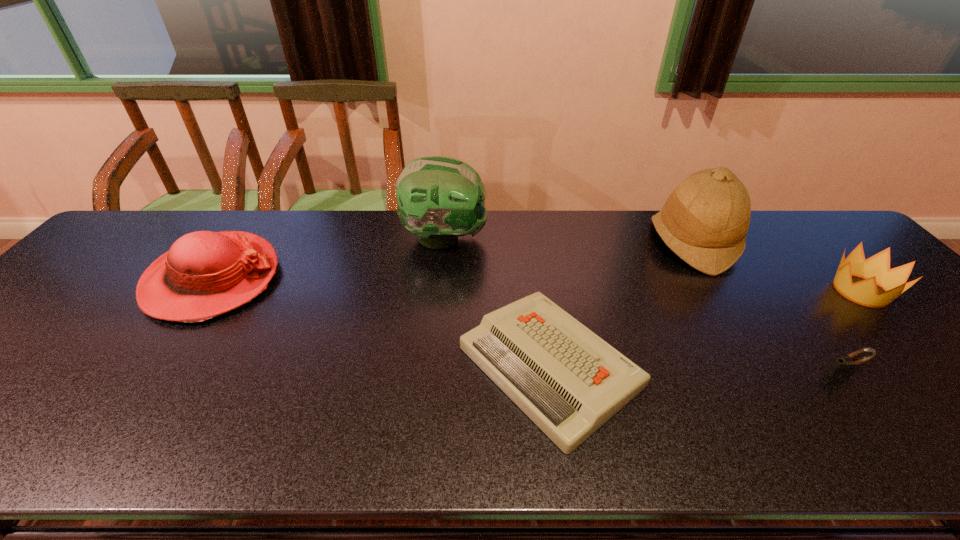
Find the location of a particular element. This screenshot has width=960, height=540. free point at the near edge is located at coordinates (944, 419).

Identify the location of free point between the padlock and the right hat. This screenshot has width=960, height=540. (768, 308).

Identify the location of blank region between the football helmet and the padlock. (644, 306).

Find the location of `free space that is in between the fourth shortest object and the computer keyboard`. free space that is in between the fourth shortest object and the computer keyboard is located at coordinates (381, 322).

You are a GUI agent. You are given a task and a screenshot of the screen. Output one action in this format:
    pyautogui.click(x=<x>, y=<y>)
    Task: Click on the vacant point located between the fifth tallest object and the third shortest object
    This screenshot has width=960, height=540.
    Given the screenshot: What is the action you would take?
    pyautogui.click(x=852, y=332)

The height and width of the screenshot is (540, 960). I want to click on free space between the third shortest object and the left hat, so click(537, 285).

Locate an element on the screen. Image resolution: width=960 pixels, height=540 pixels. free spot between the football helmet and the right hat is located at coordinates (568, 240).

Find the location of `free point between the leftmost object and the right hat`. free point between the leftmost object and the right hat is located at coordinates (452, 261).

The image size is (960, 540). I want to click on free space between the computer keyboard and the football helmet, so click(x=497, y=302).

This screenshot has width=960, height=540. In order to click on free space between the shortest object and the padlock in this screenshot , I will do `click(697, 370)`.